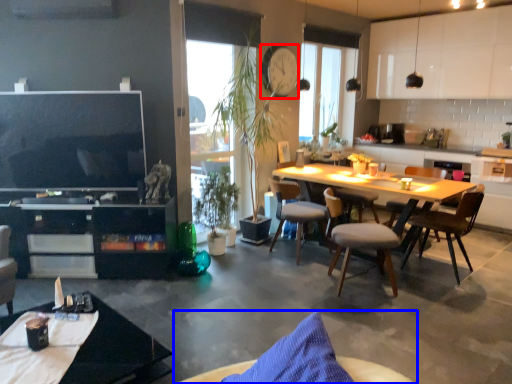
Question: Which object appears farthest to the camera in this image, clock (highlighted by a red box) or chair (highlighted by a blue box)?

Choices:
 (A) clock
 (B) chair

Answer: (A)